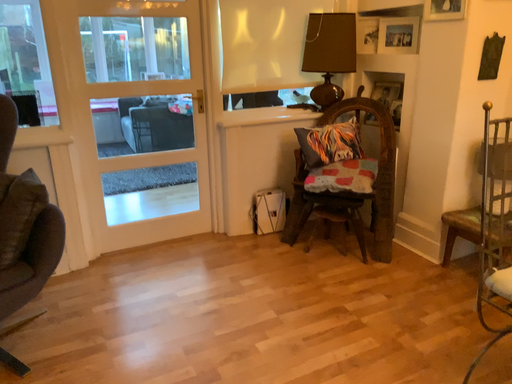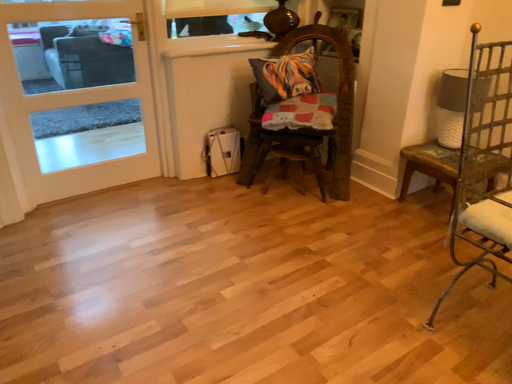
Question: How did the camera likely rotate when shooting the video?

Choices:
 (A) rotated upward
 (B) rotated downward

Answer: (B)